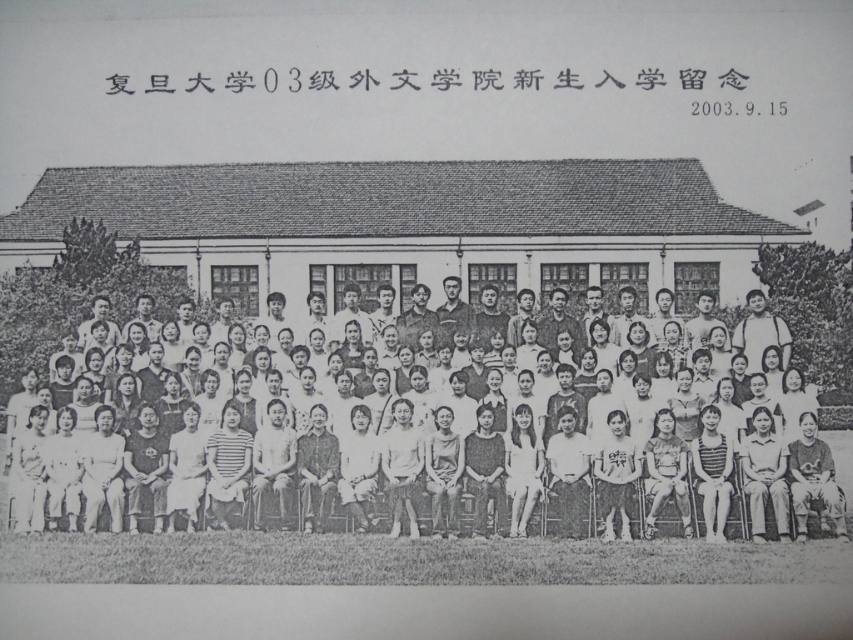
Is black paper at upper center above white cotton shirt at center?

Yes.

Between black paper at upper center and white cotton shirt at center, which one appears on the left side from the viewer's perspective?

From the viewer's perspective, white cotton shirt at center appears more on the left side.

Measure the distance between black paper at upper center and camera.

They are 62.30 meters apart.

Locate an element on the screen. This screenshot has height=640, width=853. black paper at upper center is located at coordinates (329, 81).